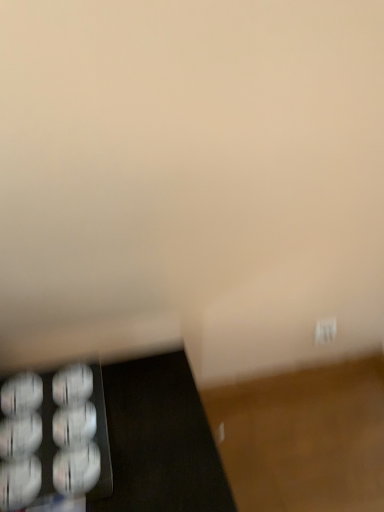
In order to face black glossy tray at lower left, should I rotate leftwards or rightwards?

Turn left by 9.722 degrees to look at black glossy tray at lower left.

This screenshot has height=512, width=384. What do you see at coordinates (160, 440) in the screenshot? I see `black glossy tray at lower left` at bounding box center [160, 440].

Where is `black glossy tray at lower left`? black glossy tray at lower left is located at coordinates (160, 440).

Find the location of a particular element. black glossy tray at lower left is located at coordinates (160, 440).